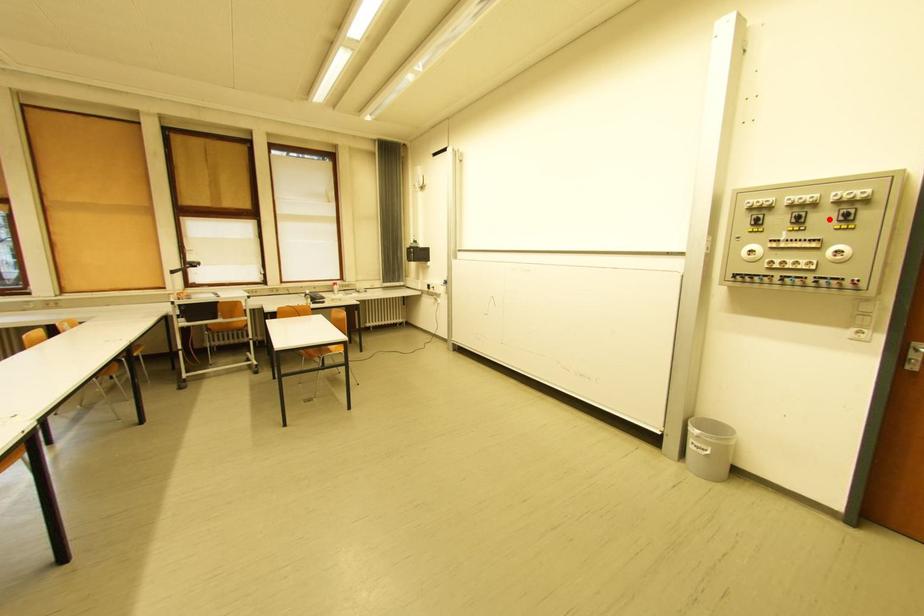
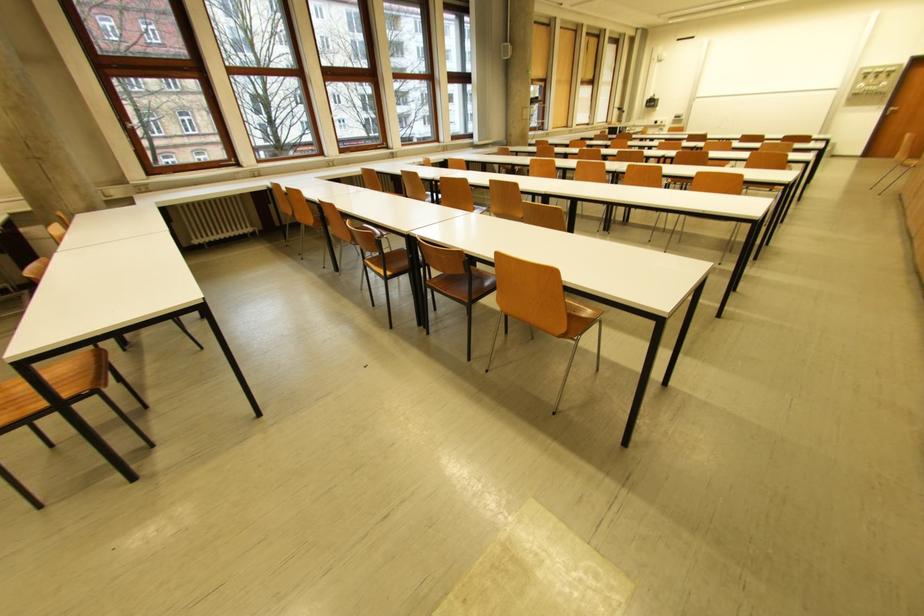
Question: I am providing you with two images of the same scene from different viewpoints. In image1, a red point is highlighted. Considering the same 3D point in image2, which of the following is correct?

Choices:
 (A) It is closer
 (B) It is farther

Answer: (B)